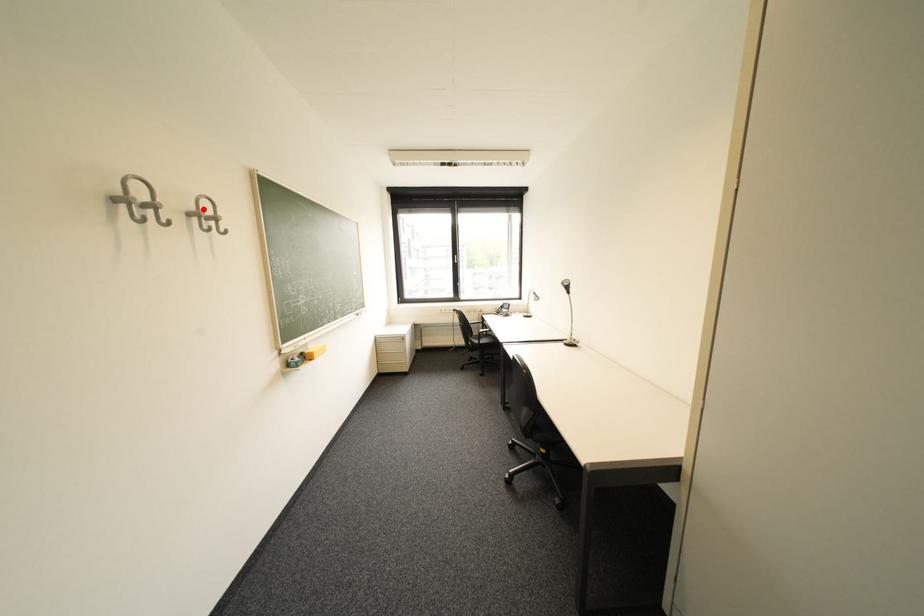
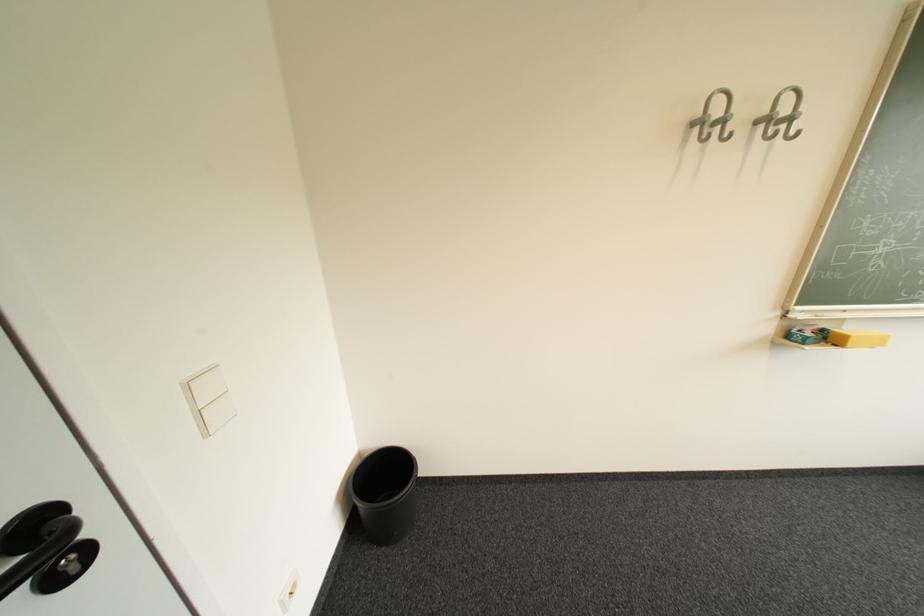
The point at the highlighted location is marked in the first image. Where is the corresponding point in the second image?

(775, 113)